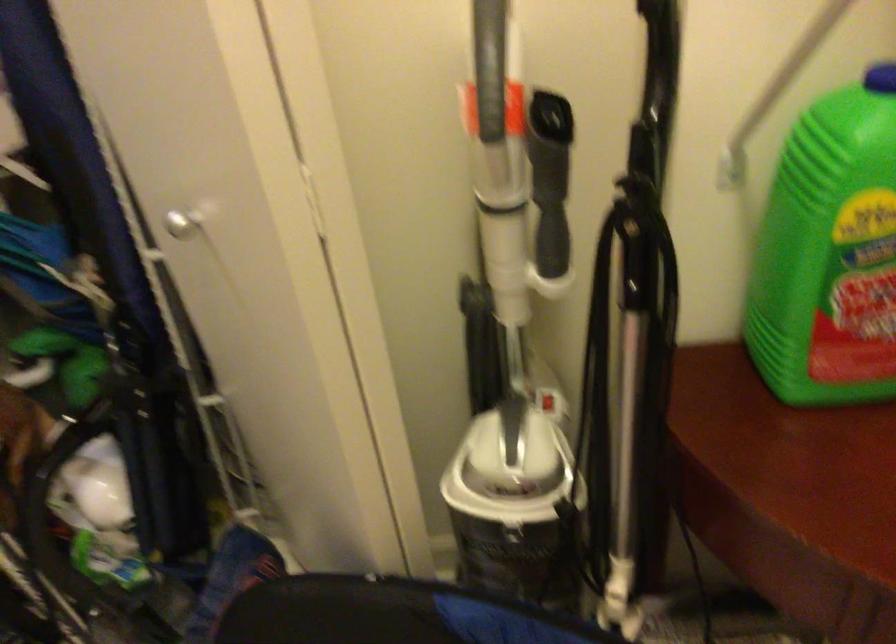
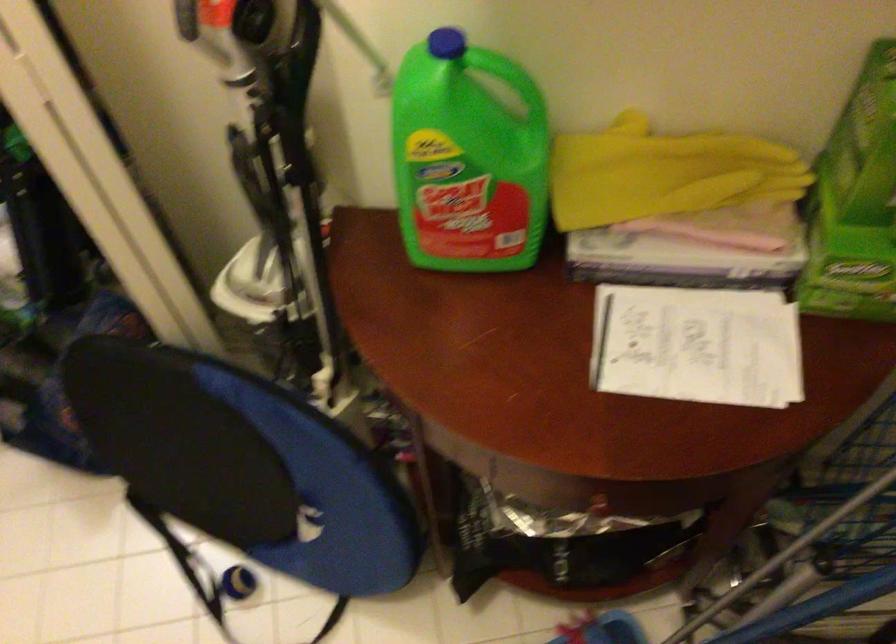
Which direction would the cameraman need to move to produce the second image?

The cameraman walked toward right, backward.